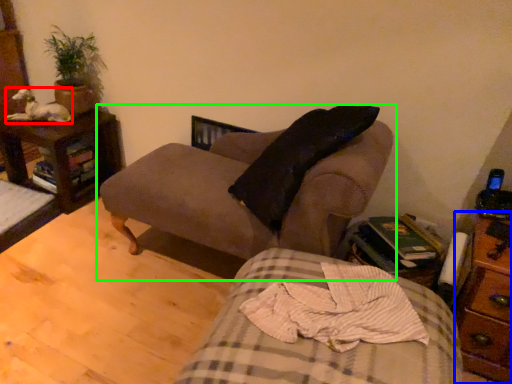
Question: Considering the real-world distances, which object is closest to animal (highlighted by a red box)? nightstand (highlighted by a blue box) or studio couch (highlighted by a green box).

Choices:
 (A) nightstand
 (B) studio couch

Answer: (B)